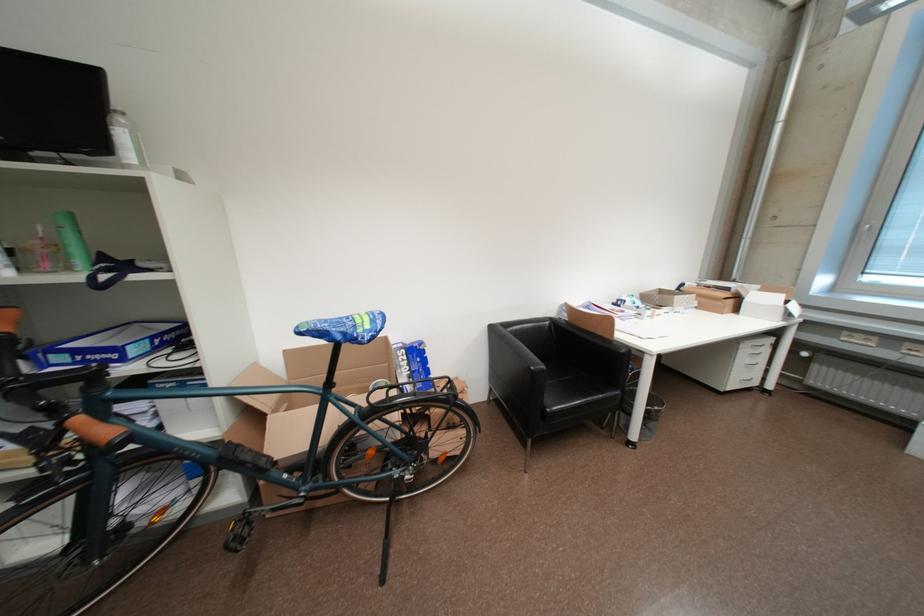
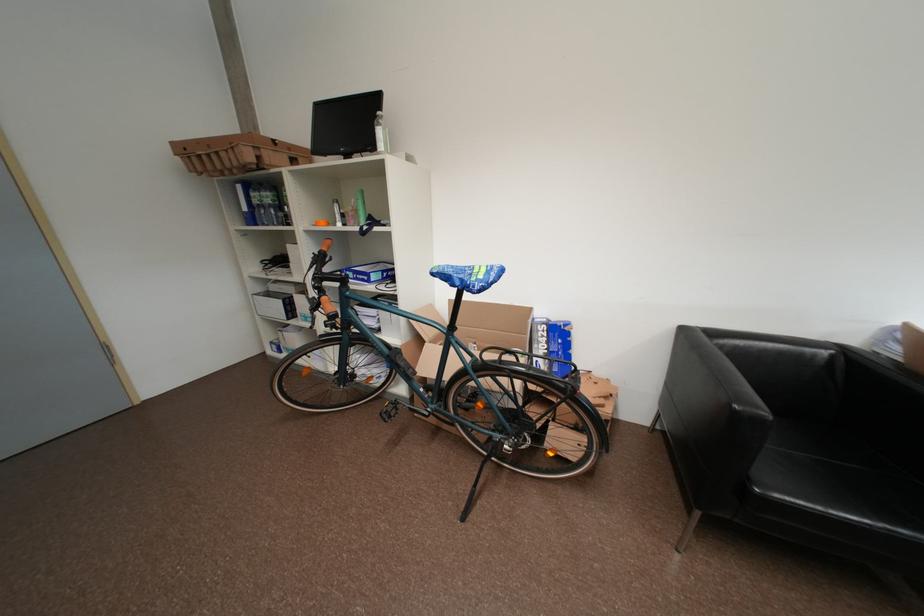
In the second image, find the point that corresponds to pixel 500 330 in the first image.

(691, 333)